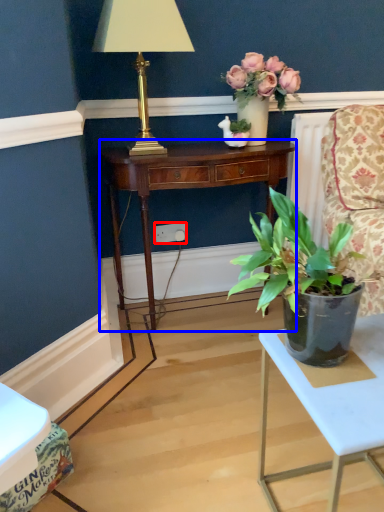
Question: Which point is closer to the camera, power outlet (highlighted by a red box) or desk (highlighted by a blue box)?

Choices:
 (A) power outlet
 (B) desk

Answer: (B)